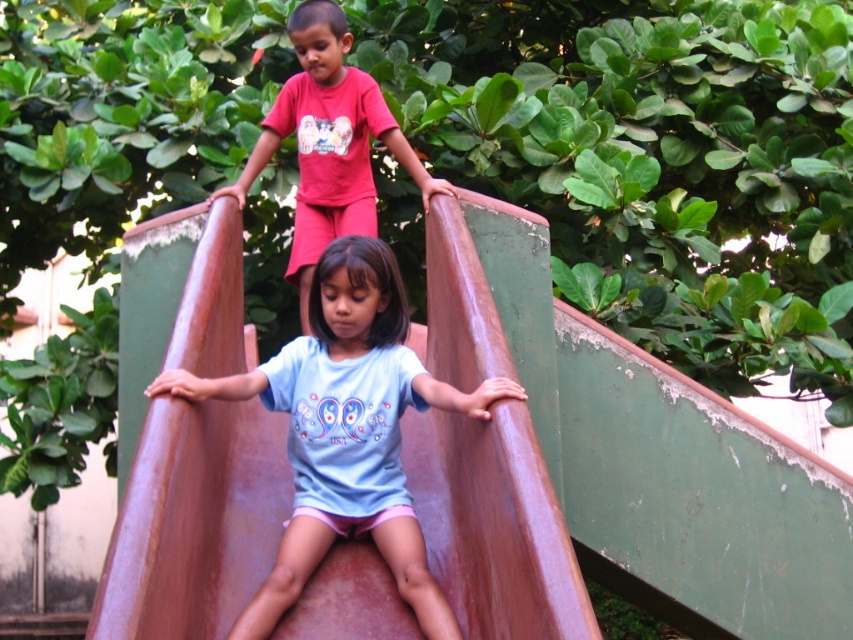
Consider the image. Measure the distance between point (308, 513) and camera.

Point (308, 513) and camera are 11.14 meters apart.

Between light blue fabric shirt at center and matte red pants at upper center, which one appears on the right side from the viewer's perspective?

light blue fabric shirt at center

This screenshot has width=853, height=640. In order to click on light blue fabric shirt at center in this screenshot , I will do `click(346, 429)`.